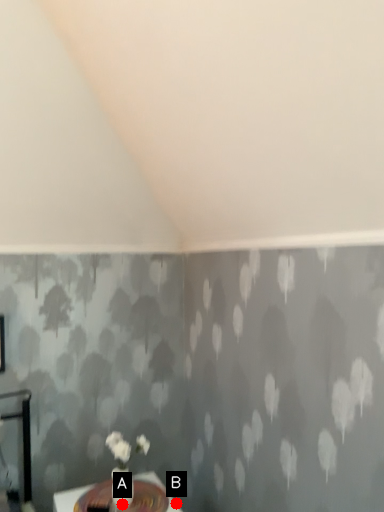
Question: Two points are circled on the image, labeled by A and B beside each circle. Which point appears closest to the camera in this image?

Choices:
 (A) A is closer
 (B) B is closer

Answer: (A)